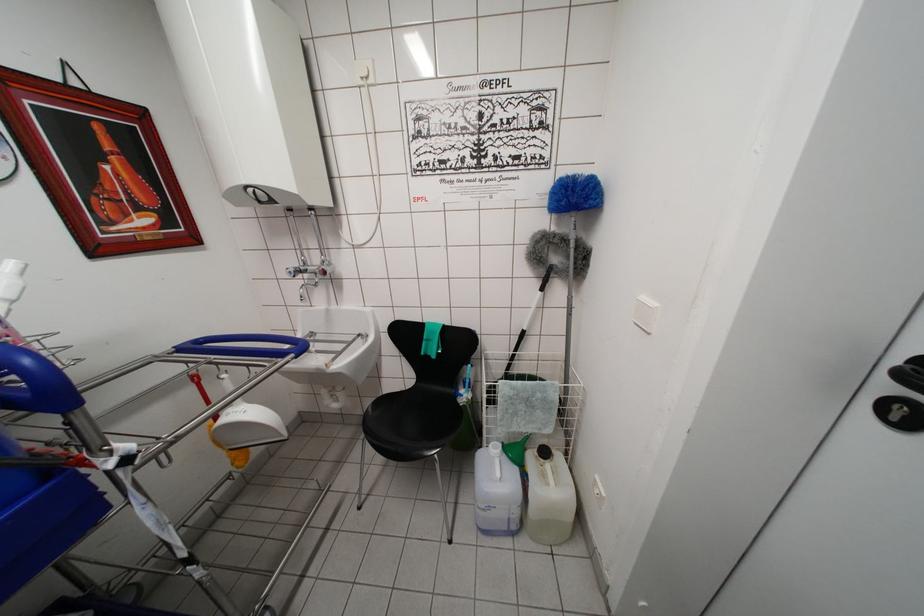
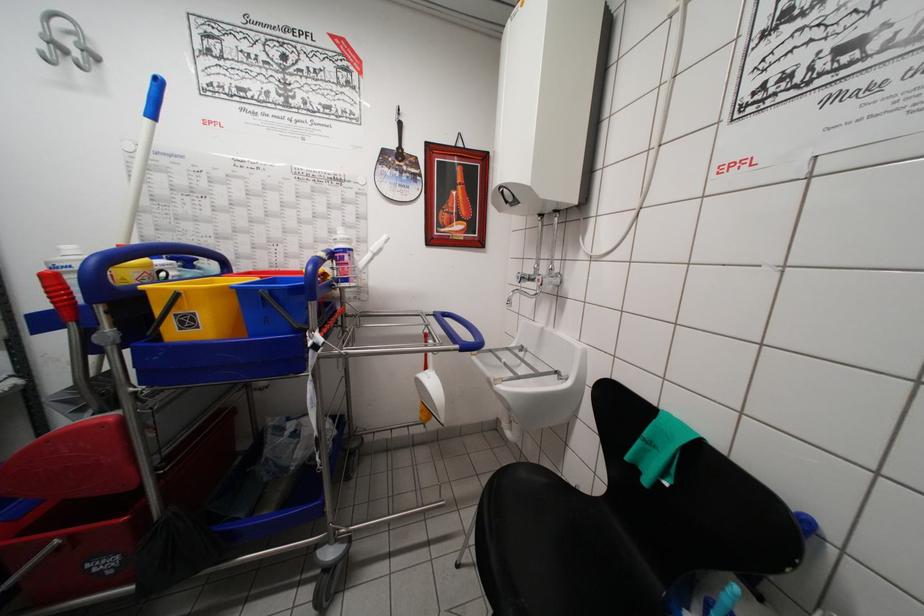
The point at [296,360] is marked in the first image. Where is the corresponding point in the second image?

(460, 351)